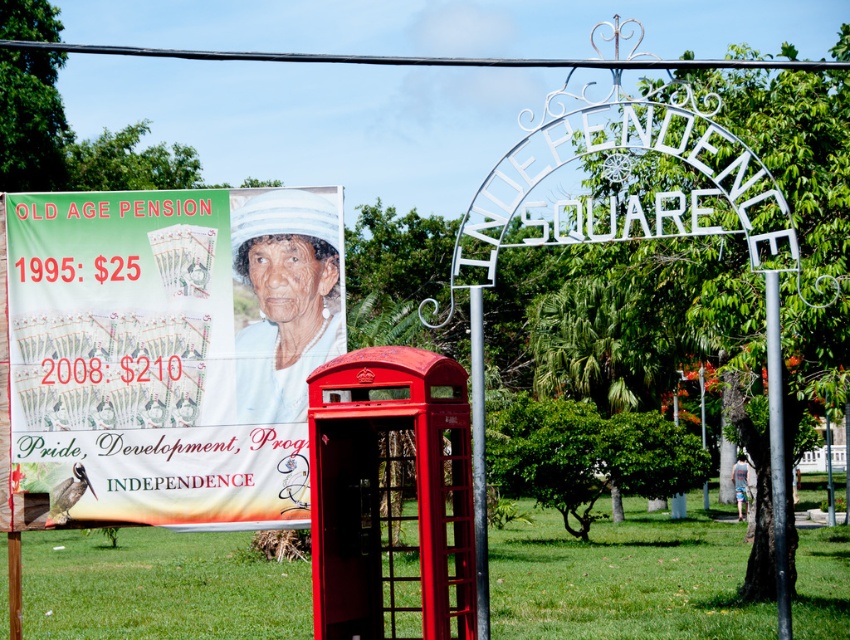
You are an artist planning to paint the scene. You need to decide which object to include first based on their sizes. Which object should you start with, the matte plastic poster at upper left or the silver metallic pole at center?

The matte plastic poster at upper left has a larger width than the silver metallic pole at center, so you should start with the matte plastic poster at upper left.

You are a tourist holding a camera and want to take a photo of the silver metallic pole at center without the matte plastic poster at upper left blocking it. Where should you position yourself to ensure the pole is visible and the poster is out of frame?

Move to the right side of the scene so that the silver metallic pole at center is visible while positioning yourself away from the matte plastic poster at upper left, which is larger and located at the upper left. This way, the poster won

You are standing at the entrance of Independence Square and want to locate the black metallic pole at center. According to the coordinates given, where would you find it in the image?

The black metallic pole at center is located at the coordinates point (775,451) in the image.